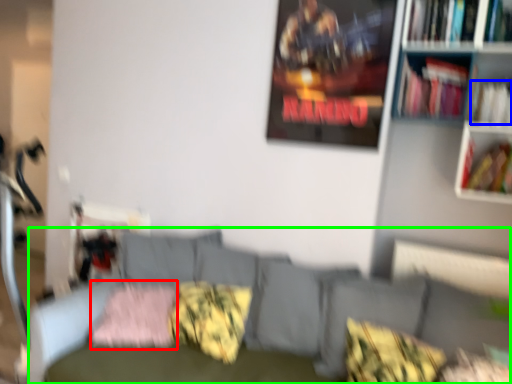
Question: Which object is the farthest from pillow (highlighted by a red box)? Choose among these: book (highlighted by a blue box) or couch (highlighted by a green box).

Choices:
 (A) book
 (B) couch

Answer: (A)